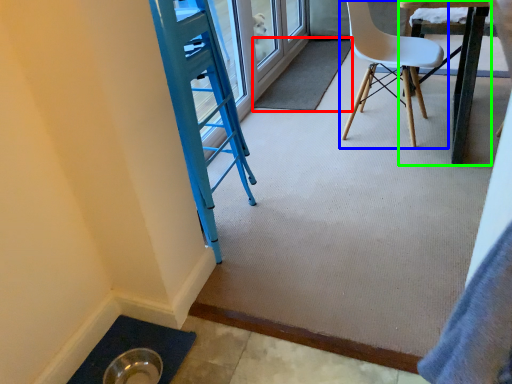
Question: Which object is the farthest from mat (highlighted by a red box)? Choose among these: chair (highlighted by a blue box) or table (highlighted by a green box).

Choices:
 (A) chair
 (B) table

Answer: (B)